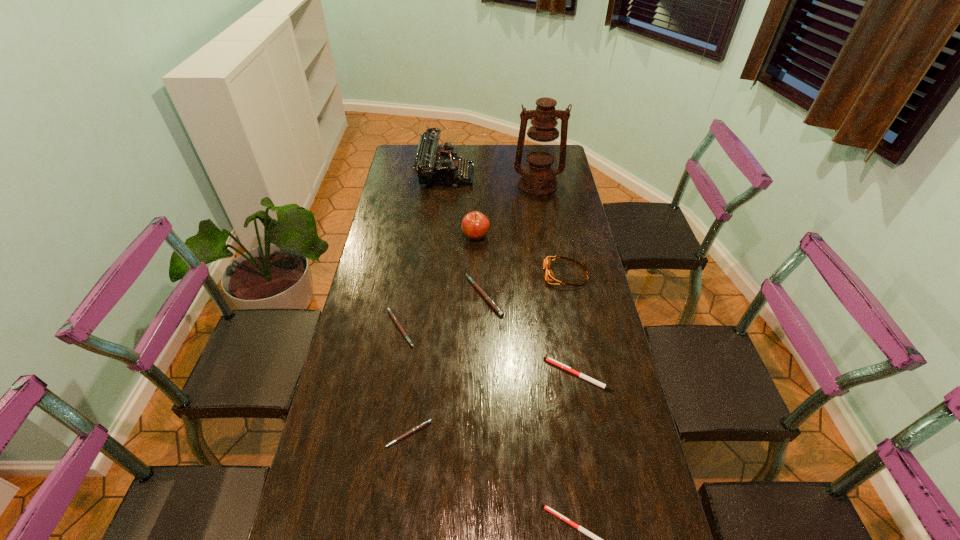
Find the location of a particular element. vacant space that satisfies the following two spatial constraints: 1. on the keyboard of the oil lamp; 2. on the left side of the typewriter is located at coordinates (444, 185).

Where is `vacant space that satisfies the following two spatial constraints: 1. on the keyboard of the second tallest object; 2. on the left side of the apple`? Image resolution: width=960 pixels, height=540 pixels. vacant space that satisfies the following two spatial constraints: 1. on the keyboard of the second tallest object; 2. on the left side of the apple is located at coordinates (439, 237).